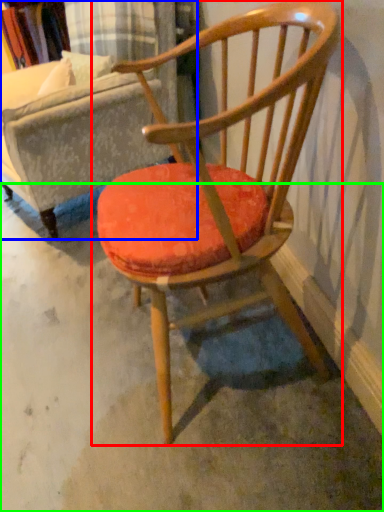
Question: Estimate the real-world distances between objects in this image. Which object is closer to chair (highlighted by a red box), swivel chair (highlighted by a blue box) or concrete (highlighted by a green box)?

Choices:
 (A) swivel chair
 (B) concrete

Answer: (B)